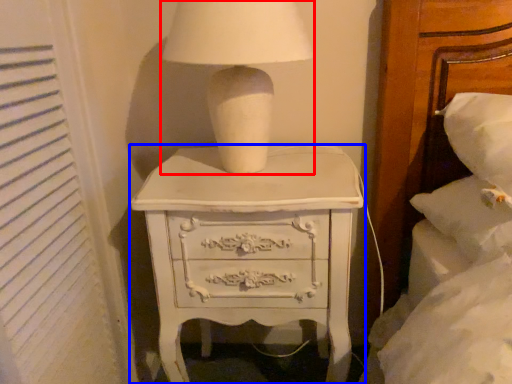
Question: Which object appears closest to the camera in this image, table lamp (highlighted by a red box) or chest of drawers (highlighted by a blue box)?

Choices:
 (A) table lamp
 (B) chest of drawers

Answer: (A)